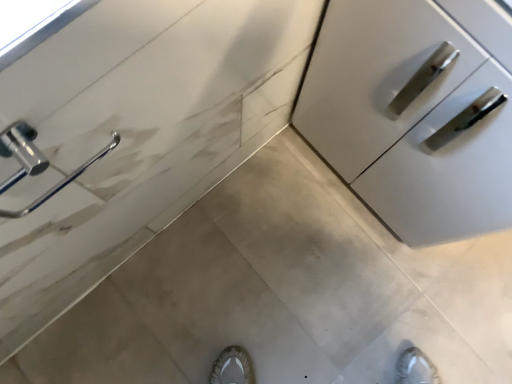
This screenshot has height=384, width=512. What do you see at coordinates (21, 151) in the screenshot?
I see `chrome/metallic door handle at left` at bounding box center [21, 151].

At what (x,y) coordinates should I click in order to perform the action: click on chrome/metallic door handle at left. Please return your answer as a coordinate pair (x, y). The height and width of the screenshot is (384, 512). Looking at the image, I should click on (21, 151).

This screenshot has width=512, height=384. What do you see at coordinates (416, 112) in the screenshot?
I see `satin white cabinet at right` at bounding box center [416, 112].

Measure the distance between satin white cabinet at right and camera.

They are 45.23 centimeters apart.

Identify the location of satin white cabinet at right. The height and width of the screenshot is (384, 512). (416, 112).

Locate an element on the screen. This screenshot has width=512, height=384. chrome/metallic door handle at left is located at coordinates (21, 151).

Does satin white cabinet at right appear on the right side of chrome/metallic door handle at left?

Yes, satin white cabinet at right is to the right of chrome/metallic door handle at left.

Does satin white cabinet at right come in front of chrome/metallic door handle at left?

No, satin white cabinet at right is further to the viewer.

Which is closer to the camera, (338, 166) or (9, 141)?

Point (338, 166).

From the image's perspective, does satin white cabinet at right appear higher than chrome/metallic door handle at left?

Yes.

From a real-world perspective, does satin white cabinet at right sit lower than chrome/metallic door handle at left?

Yes, from a real-world perspective, satin white cabinet at right is under chrome/metallic door handle at left.

Looking at their sizes, would you say satin white cabinet at right is wider or thinner than chrome/metallic door handle at left?

Considering their sizes, satin white cabinet at right looks broader than chrome/metallic door handle at left.

Between satin white cabinet at right and chrome/metallic door handle at left, which one has more height?

Standing taller between the two is satin white cabinet at right.

Is satin white cabinet at right bigger than chrome/metallic door handle at left?

Correct, satin white cabinet at right is larger in size than chrome/metallic door handle at left.

Is chrome/metallic door handle at left completely or partially inside satin white cabinet at right?

No, satin white cabinet at right does not contain chrome/metallic door handle at left.

Is satin white cabinet at right next to chrome/metallic door handle at left?

No, satin white cabinet at right is not with chrome/metallic door handle at left.

Consider the image. Is satin white cabinet at right facing towards chrome/metallic door handle at left?

Yes, satin white cabinet at right is aimed at chrome/metallic door handle at left.

What's the angular difference between satin white cabinet at right and chrome/metallic door handle at left's facing directions?

91 degrees.

The image size is (512, 384). Find the location of `door handle below the satin white cabinet at right (from the image's perspective)`. door handle below the satin white cabinet at right (from the image's perspective) is located at coordinates point(21,151).

In the image, is chrome/metallic door handle at left on the left side or the right side of satin white cabinet at right?

Clearly, chrome/metallic door handle at left is on the left of satin white cabinet at right in the image.

In the image, is chrome/metallic door handle at left positioned in front of or behind satin white cabinet at right?

In the image, chrome/metallic door handle at left appears in front of satin white cabinet at right.

Considering the points (34, 136) and (439, 182), which point is behind, point (34, 136) or point (439, 182)?

Point (439, 182)

From the image's perspective, who appears lower, chrome/metallic door handle at left or satin white cabinet at right?

chrome/metallic door handle at left.

From a real-world perspective, which object stands above the other?

chrome/metallic door handle at left.

Considering the relative sizes of chrome/metallic door handle at left and satin white cabinet at right in the image provided, is chrome/metallic door handle at left wider than satin white cabinet at right?

In fact, chrome/metallic door handle at left might be narrower than satin white cabinet at right.

Between chrome/metallic door handle at left and satin white cabinet at right, which one has more height?

satin white cabinet at right.

Considering the sizes of objects chrome/metallic door handle at left and satin white cabinet at right in the image provided, who is smaller, chrome/metallic door handle at left or satin white cabinet at right?

With smaller size is chrome/metallic door handle at left.

Would you say chrome/metallic door handle at left is outside satin white cabinet at right?

chrome/metallic door handle at left is positioned outside satin white cabinet at right.

Are chrome/metallic door handle at left and satin white cabinet at right located far from each other?

No, chrome/metallic door handle at left is not far away from satin white cabinet at right.

Is chrome/metallic door handle at left facing away from satin white cabinet at right?

No, chrome/metallic door handle at left's orientation is not away from satin white cabinet at right.

Can you tell me how much chrome/metallic door handle at left and satin white cabinet at right differ in facing direction?

The angle between the facing direction of chrome/metallic door handle at left and the facing direction of satin white cabinet at right is 91 degrees.

Find the location of `cabinetry on the right of chrome/metallic door handle at left`. cabinetry on the right of chrome/metallic door handle at left is located at coordinates (416, 112).

This screenshot has height=384, width=512. What are the coordinates of `door handle located in front of the satin white cabinet at right` in the screenshot? It's located at (21, 151).

In the image, there is a satin white cabinet at right. Identify the location of door handle below it (from the image's perspective). The width and height of the screenshot is (512, 384). (21, 151).